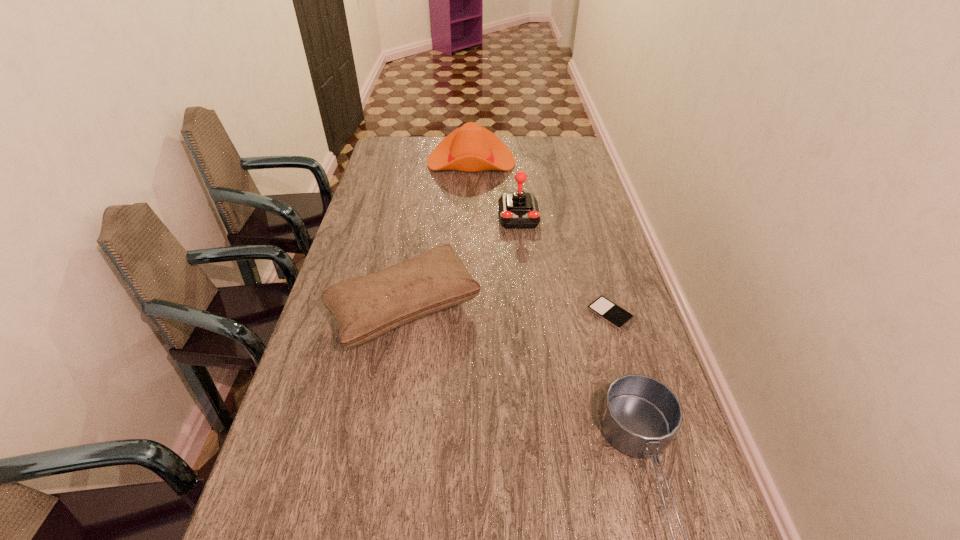
Identify which object is the fourth nearest to the farthest object. Please provide its 2D coordinates. Your answer should be formatted as a tuple, i.e. [(x, y)], where the tuple contains the x and y coordinates of a point satisfying the conditions above.

[(640, 416)]

Locate which object ranks in proximity to the second shortest object. Please provide its 2D coordinates. Your answer should be formatted as a tuple, i.e. [(x, y)], where the tuple contains the x and y coordinates of a point satisfying the conditions above.

[(604, 308)]